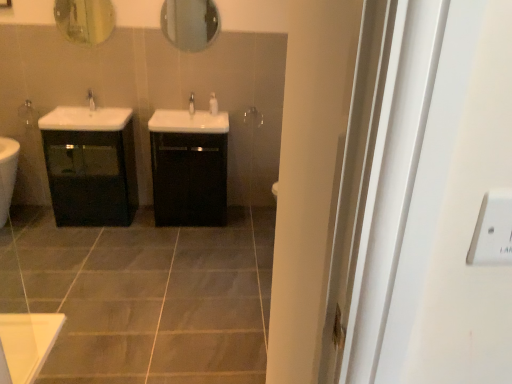
Question: Is white glossy tap at center, the 2th tap positioned from the left, not within white glossy soap dispenser at center?

Choices:
 (A) yes
 (B) no

Answer: (A)

Question: Can you confirm if white glossy tap at center, which appears as the 1th tap when viewed from the right, is smaller than white glossy soap dispenser at center?

Choices:
 (A) no
 (B) yes

Answer: (A)

Question: Is white glossy tap at center, which appears as the 1th tap when viewed from the right, closer to the viewer compared to white glossy soap dispenser at center?

Choices:
 (A) yes
 (B) no

Answer: (A)

Question: Is white glossy tap at center, which appears as the 1th tap when viewed from the right, looking in the opposite direction of white glossy soap dispenser at center?

Choices:
 (A) no
 (B) yes

Answer: (A)

Question: Does white glossy tap at center, the 2th tap positioned from the left, appear on the left side of white glossy soap dispenser at center?

Choices:
 (A) yes
 (B) no

Answer: (A)

Question: Is black glossy cabinet at center, which appears as the 2th bathroom cabinet when viewed from the left, in front of or behind white glossy tap at center, the 2th tap positioned from the left, in the image?

Choices:
 (A) front
 (B) behind

Answer: (A)

Question: From the image's perspective, is black glossy cabinet at center, arranged as the 1th bathroom cabinet when viewed from the right, located above or below white glossy tap at center, which appears as the 1th tap when viewed from the right?

Choices:
 (A) below
 (B) above

Answer: (A)

Question: In terms of height, does black glossy cabinet at center, which appears as the 2th bathroom cabinet when viewed from the left, look taller or shorter compared to white glossy tap at center, which appears as the 1th tap when viewed from the right?

Choices:
 (A) short
 (B) tall

Answer: (B)

Question: Would you say black glossy cabinet at center, arranged as the 1th bathroom cabinet when viewed from the right, is to the left or to the right of white glossy tap at center, the 2th tap positioned from the left, in the picture?

Choices:
 (A) right
 (B) left

Answer: (B)

Question: From the image's perspective, relative to black glossy cabinet at center, arranged as the 1th bathroom cabinet when viewed from the right, is white glossy tap at center, which appears as the 1th tap when viewed from the right, above or below?

Choices:
 (A) above
 (B) below

Answer: (A)

Question: Is white glossy tap at center, the 2th tap positioned from the left, taller or shorter than black glossy cabinet at center, which appears as the 2th bathroom cabinet when viewed from the left?

Choices:
 (A) tall
 (B) short

Answer: (B)

Question: Based on their sizes in the image, would you say white glossy tap at center, the 2th tap positioned from the left, is bigger or smaller than black glossy cabinet at center, which appears as the 2th bathroom cabinet when viewed from the left?

Choices:
 (A) small
 (B) big

Answer: (A)

Question: Considering their positions, is white glossy tap at center, which appears as the 1th tap when viewed from the right, located in front of or behind black glossy cabinet at center, arranged as the 1th bathroom cabinet when viewed from the right?

Choices:
 (A) behind
 (B) front

Answer: (A)

Question: Considering the positions of gray matte tile at center and matte glass mirror at upper left, arranged as the 1th mirror when viewed from the left, in the image, is gray matte tile at center taller or shorter than matte glass mirror at upper left, arranged as the 1th mirror when viewed from the left,?

Choices:
 (A) short
 (B) tall

Answer: (A)

Question: Do you think gray matte tile at center is within matte glass mirror at upper left, the 2th mirror from the right, or outside of it?

Choices:
 (A) inside
 (B) outside

Answer: (B)